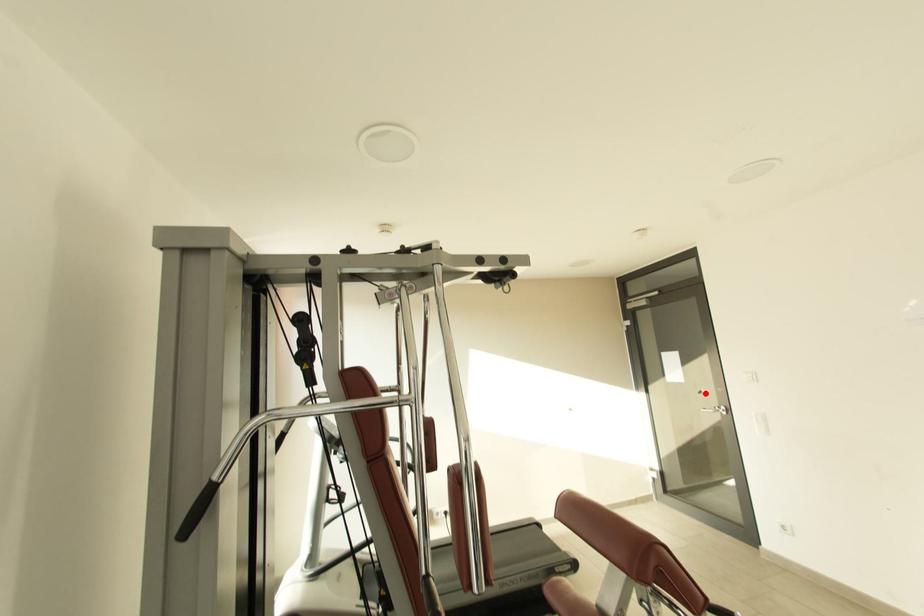
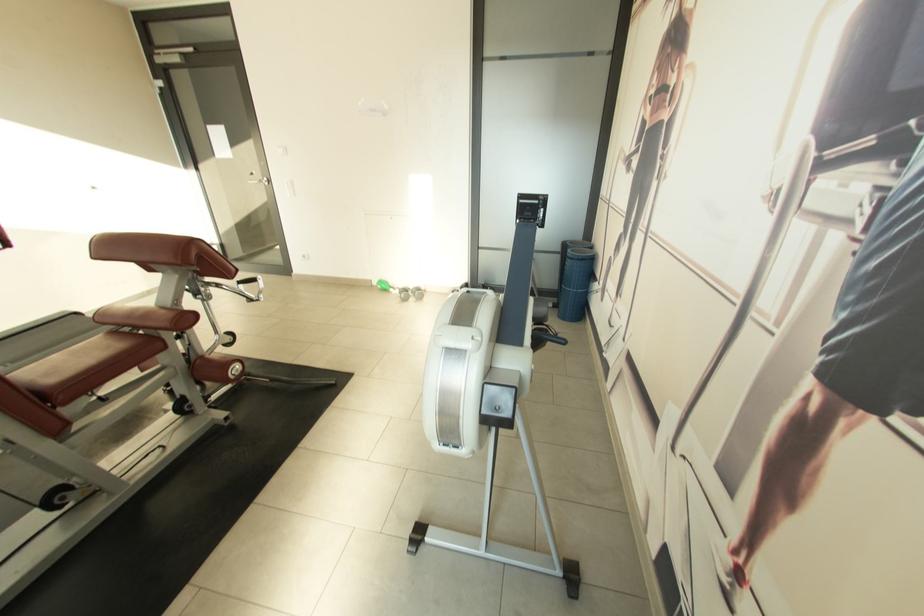
Question: A red point is marked in image1. In image2, is the corresponding 3D point closer to the camera or farther? Reply with the corresponding letter.

Choices:
 (A) The corresponding 3D point is closer.
 (B) The corresponding 3D point is farther.

Answer: (A)